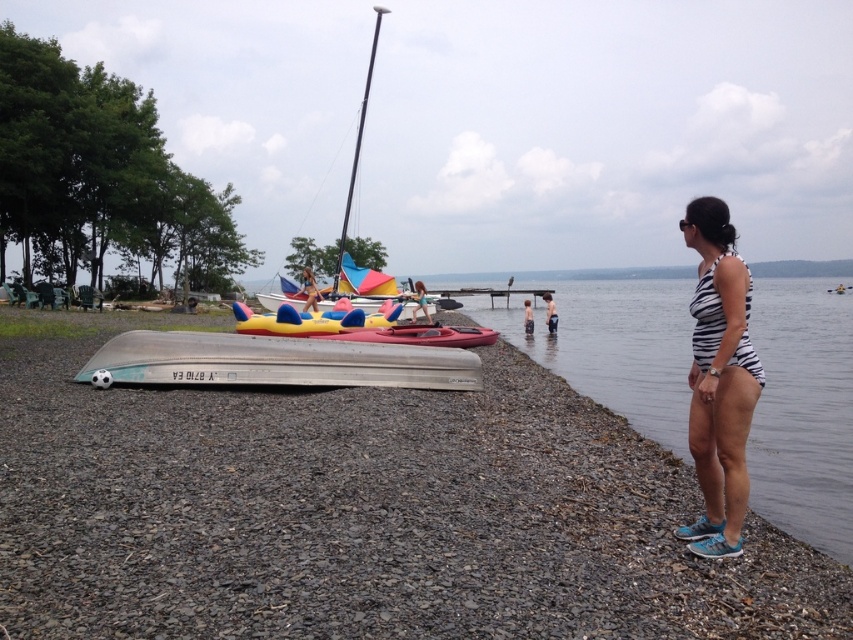
Question: Which of the following is the closest to the observer?

Choices:
 (A) (282, 317)
 (B) (367, 384)

Answer: (B)

Question: Is silver metallic canoe at lower left thinner than matte pink bikini at center?

Choices:
 (A) yes
 (B) no

Answer: (B)

Question: Which point is closer to the camera?

Choices:
 (A) (544, 502)
 (B) (477, 371)

Answer: (A)

Question: Is silver metallic canoe at lower left above striped swimsuit at lower center?

Choices:
 (A) yes
 (B) no

Answer: (B)

Question: Which point is closer to the camera?

Choices:
 (A) (834, 449)
 (B) (287, 316)
 (C) (552, 307)

Answer: (A)

Question: Can you confirm if smooth gray gravel at lower left is positioned above matte yellow kayak at center?

Choices:
 (A) yes
 (B) no

Answer: (B)